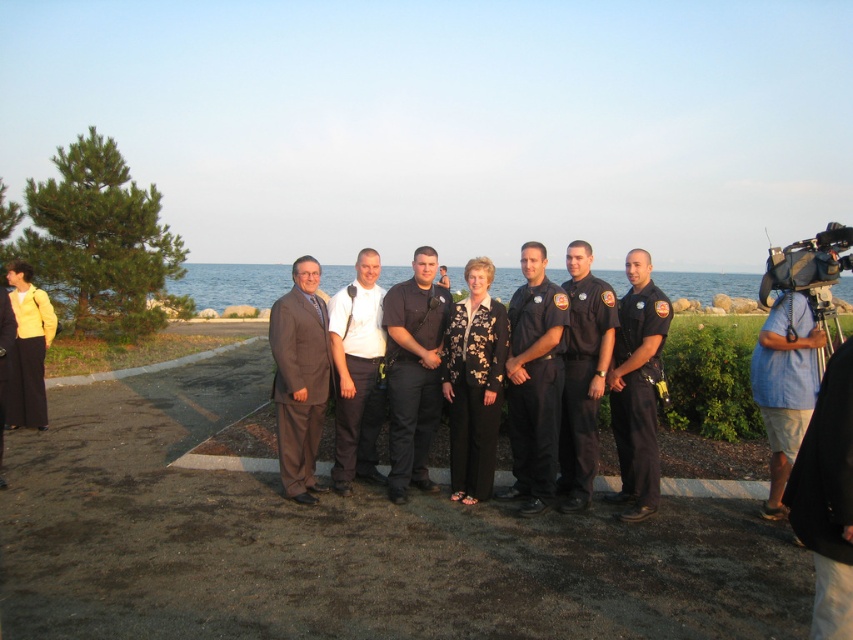
Question: Which of the following is the farthest from the observer?

Choices:
 (A) (521, 410)
 (B) (422, 452)

Answer: (B)

Question: Which of these objects is positioned closest to the dark gray uniform at center?

Choices:
 (A) dark blue uniform at center
 (B) blue shirt at right
 (C) black uniform at center

Answer: (A)

Question: Does black uniform pants at center appear on the right side of dark gray uniform at center?

Choices:
 (A) no
 (B) yes

Answer: (B)

Question: Is brown suit at center thinner than black plastic video camera at right?

Choices:
 (A) no
 (B) yes

Answer: (B)

Question: Does white cotton shirt at center appear over black plastic video camera at right?

Choices:
 (A) yes
 (B) no

Answer: (B)

Question: Which object is positioned farthest from the dark blue uniform at center?

Choices:
 (A) black plastic video camera at right
 (B) dark gray uniform at center

Answer: (A)